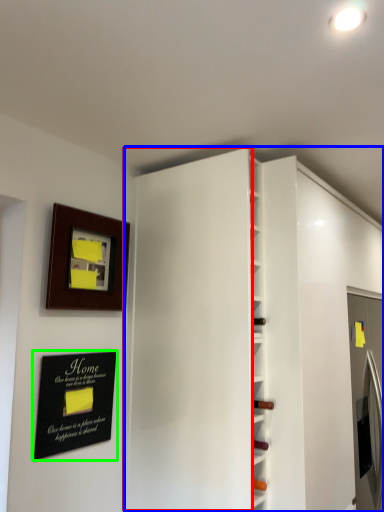
Question: Which is nearer to the door (highlighted by a red box)? bookshelf (highlighted by a blue box) or plaque (highlighted by a green box).

Choices:
 (A) bookshelf
 (B) plaque

Answer: (A)